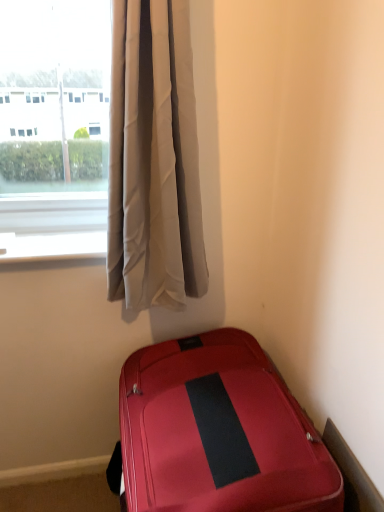
Question: Can you confirm if shiny red suitcase at lower right is bigger than silky white curtains at upper left?

Choices:
 (A) no
 (B) yes

Answer: (B)

Question: Is shiny red suitcase at lower right facing away from silky white curtains at upper left?

Choices:
 (A) no
 (B) yes

Answer: (A)

Question: Does shiny red suitcase at lower right appear on the left side of silky white curtains at upper left?

Choices:
 (A) yes
 (B) no

Answer: (B)

Question: From a real-world perspective, is shiny red suitcase at lower right under silky white curtains at upper left?

Choices:
 (A) yes
 (B) no

Answer: (A)

Question: Could you tell me if shiny red suitcase at lower right is facing silky white curtains at upper left?

Choices:
 (A) yes
 (B) no

Answer: (B)

Question: From a real-world perspective, is shiny red suitcase at lower right over silky white curtains at upper left?

Choices:
 (A) no
 (B) yes

Answer: (A)

Question: Can you confirm if silky white curtains at upper left is bigger than shiny red suitcase at lower right?

Choices:
 (A) yes
 (B) no

Answer: (B)

Question: From the image's perspective, is silky white curtains at upper left on shiny red suitcase at lower right?

Choices:
 (A) no
 (B) yes

Answer: (B)

Question: From a real-world perspective, is silky white curtains at upper left beneath shiny red suitcase at lower right?

Choices:
 (A) yes
 (B) no

Answer: (B)

Question: Can you confirm if silky white curtains at upper left is wider than shiny red suitcase at lower right?

Choices:
 (A) yes
 (B) no

Answer: (B)

Question: Are silky white curtains at upper left and shiny red suitcase at lower right located far from each other?

Choices:
 (A) yes
 (B) no

Answer: (B)

Question: Could you tell me if silky white curtains at upper left is facing shiny red suitcase at lower right?

Choices:
 (A) no
 (B) yes

Answer: (A)

Question: Is silky white curtains at upper left in front of or behind shiny red suitcase at lower right in the image?

Choices:
 (A) front
 (B) behind

Answer: (B)